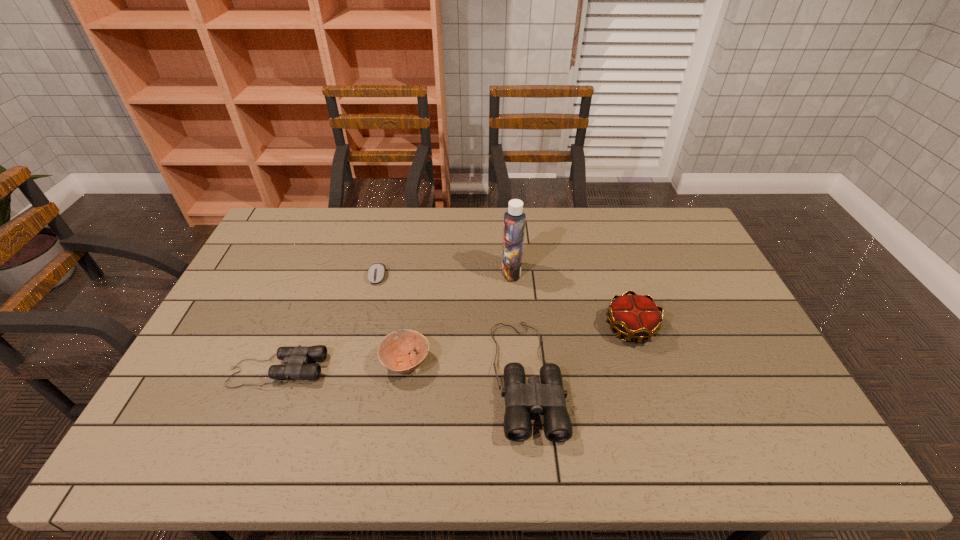
Where is `the leftmost object`? This screenshot has height=540, width=960. the leftmost object is located at coordinates (296, 358).

The width and height of the screenshot is (960, 540). Find the location of `the second shortest object`. the second shortest object is located at coordinates (296, 358).

The image size is (960, 540). I want to click on the right binoculars, so click(x=548, y=397).

Find the location of `crown`. crown is located at coordinates (635, 316).

You are a GUI agent. You are given a task and a screenshot of the screen. Output one action in this format:
    pyautogui.click(x=<x>, y=<y>)
    Task: Click on the shortest object
    
    Given the screenshot: What is the action you would take?
    pyautogui.click(x=376, y=272)

Identify the location of computer equipment. Image resolution: width=960 pixels, height=540 pixels. (376, 272).

Locate an element on the screen. This screenshot has width=960, height=540. the tallest object is located at coordinates (514, 219).

At what (x,y) coordinates should I click in order to perform the action: click on the third shortest object. Please return your answer as a coordinate pair (x, y). This screenshot has width=960, height=540. Looking at the image, I should click on (393, 354).

Locate an element on the screen. This screenshot has width=960, height=540. the fourth object from right to left is located at coordinates (393, 354).

You are a GUI agent. You are given a task and a screenshot of the screen. Output one action in this format:
    pyautogui.click(x=<x>, y=<y>)
    Task: Click on the free space located 0.230m at the eyepiece of the fifth tallest object
    
    Given the screenshot: What is the action you would take?
    pyautogui.click(x=408, y=370)